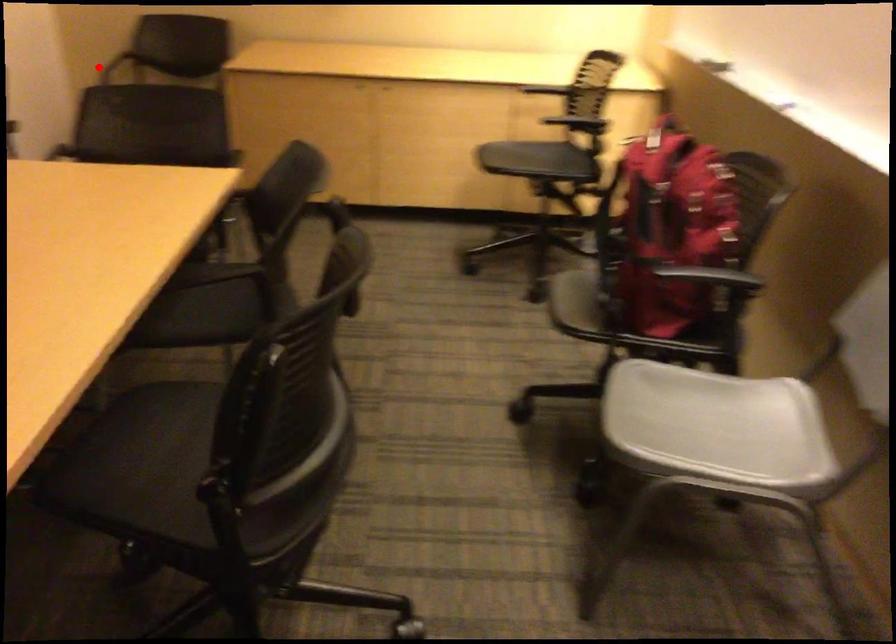
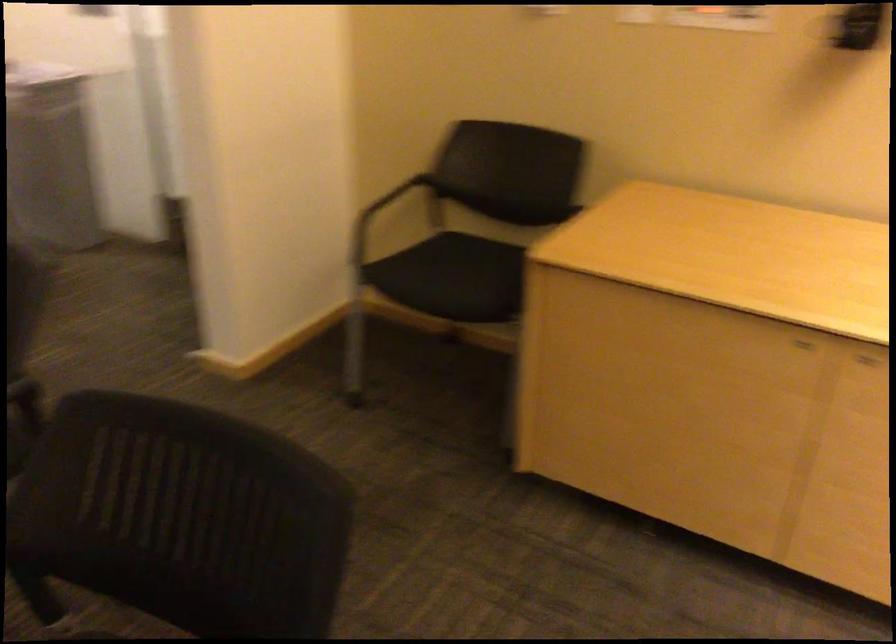
Question: A red point is marked in image1. In image2, is the corresponding 3D point closer to the camera or farther? Reply with the corresponding letter.

Choices:
 (A) The corresponding 3D point is closer.
 (B) The corresponding 3D point is farther.

Answer: (A)